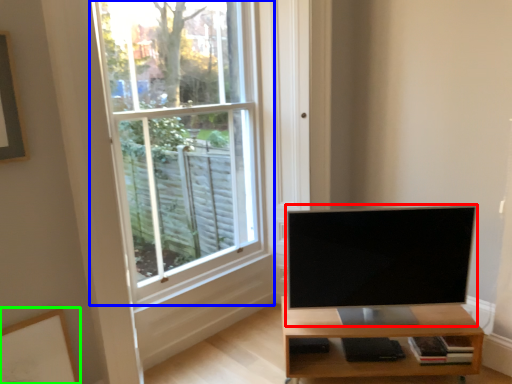
Question: Estimate the real-world distances between objects in this image. Which object is farther from television (highlighted by a red box), window (highlighted by a blue box) or picture frame (highlighted by a green box)?

Choices:
 (A) window
 (B) picture frame

Answer: (B)